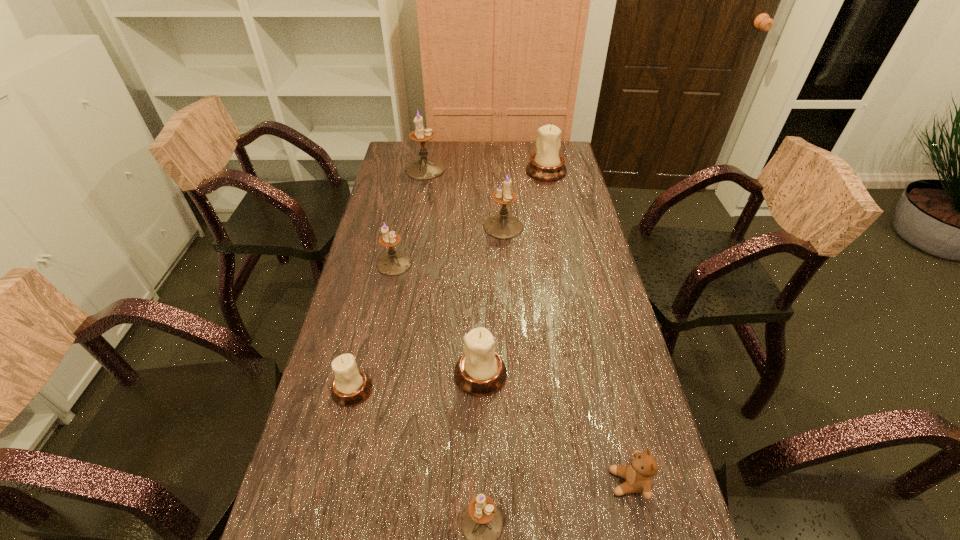
Identify the location of free space between the brown teddy bear and the biggest white candle holder. This screenshot has width=960, height=540. (588, 327).

Find the location of `unoccupied position between the sixth nearest object and the farthest purple candle holder`. unoccupied position between the sixth nearest object and the farthest purple candle holder is located at coordinates (465, 198).

You are a GUI agent. You are given a task and a screenshot of the screen. Output one action in this format:
    pyautogui.click(x=<x>, y=<y>)
    Task: Click on the free space between the leftmost white candle holder and the tallest candle holder
    
    Given the screenshot: What is the action you would take?
    pyautogui.click(x=389, y=279)

This screenshot has width=960, height=540. I want to click on vacant area between the farthest purple candle holder and the fourth nearest candle holder, so click(410, 217).

Image resolution: width=960 pixels, height=540 pixels. What are the coordinates of `free spot between the third farthest purple candle holder and the second smallest white candle holder` in the screenshot? It's located at (438, 319).

This screenshot has height=540, width=960. I want to click on empty space that is in between the sixth nearest object and the second smallest white candle holder, so click(x=492, y=300).

Select which object appears as the sixth closest to the second smallest purple candle holder. Please provide its 2D coordinates. Your answer should be formatted as a tuple, i.e. [(x, y)], where the tuple contains the x and y coordinates of a point satisfying the conditions above.

[(482, 524)]

Select which object appears as the fourth closest to the fourth nearest candle holder. Please provide its 2D coordinates. Your answer should be formatted as a tuple, i.e. [(x, y)], where the tuple contains the x and y coordinates of a point satisfying the conditions above.

[(425, 168)]

Where is `candle holder that stands as the sixth closest to the brown teddy bear`? This screenshot has height=540, width=960. candle holder that stands as the sixth closest to the brown teddy bear is located at coordinates (546, 165).

The image size is (960, 540). I want to click on candle holder that is the sixth nearest to the third farthest object, so click(x=482, y=524).